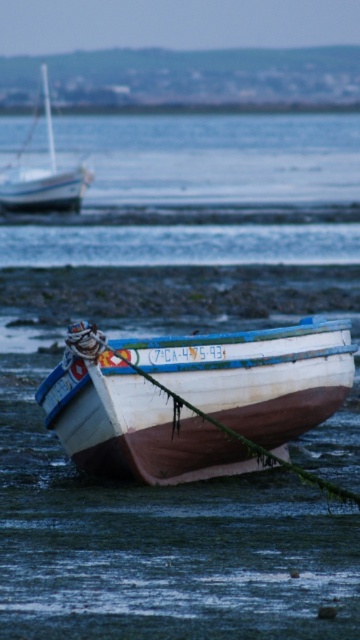
Is wooden boat at lower center to the left of white matte sailboat at upper left from the viewer's perspective?

Incorrect, wooden boat at lower center is not on the left side of white matte sailboat at upper left.

Can you confirm if wooden boat at lower center is positioned to the right of white matte sailboat at upper left?

Yes, wooden boat at lower center is to the right of white matte sailboat at upper left.

This screenshot has width=360, height=640. What do you see at coordinates (255, 376) in the screenshot?
I see `wooden boat at lower center` at bounding box center [255, 376].

Find the location of a particular element. The height and width of the screenshot is (640, 360). wooden boat at lower center is located at coordinates (255, 376).